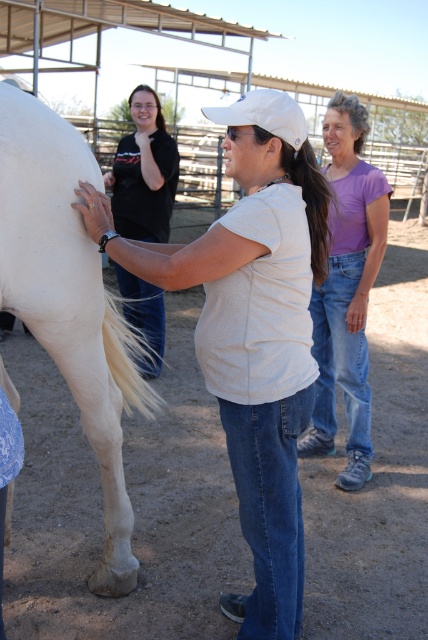
Question: Is white matte shirt at center above purple cotton shirt at center?

Choices:
 (A) no
 (B) yes

Answer: (A)

Question: Which point appears closest to the camera in this image?

Choices:
 (A) (136, 99)
 (B) (312, 280)

Answer: (B)

Question: Which of the following is the farthest from the observer?

Choices:
 (A) (312, 316)
 (B) (133, 288)
 (C) (62, 275)

Answer: (B)

Question: Observing the image, what is the correct spatial positioning of white matte shirt at center in reference to purple cotton shirt at center?

Choices:
 (A) above
 (B) below

Answer: (B)

Question: Which point is closer to the camera taking this photo?

Choices:
 (A) (356, 138)
 (B) (110, 552)

Answer: (B)

Question: Does white matte shirt at center have a smaller size compared to white matte horse at left?

Choices:
 (A) no
 (B) yes

Answer: (B)